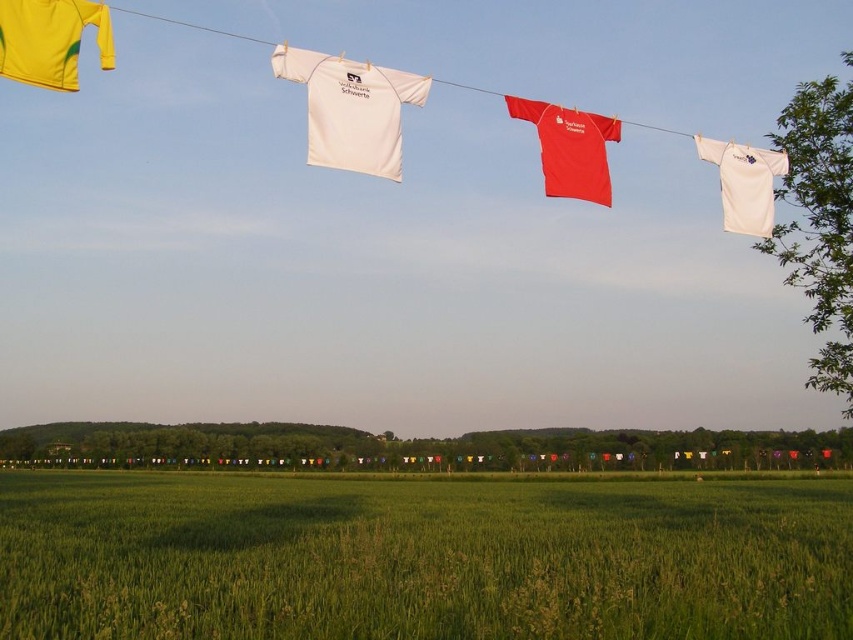
Question: Which of the following is the farthest from the observer?

Choices:
 (A) (816, 387)
 (B) (79, 492)
 (C) (323, 72)
 (D) (759, 182)

Answer: (B)

Question: Which object is positioned farthest from the matte red t-shirt at center?

Choices:
 (A) white matte t-shirt at upper center
 (B) white fabric shirt at center
 (C) green leafy tree at upper right
 (D) green grass at lower center

Answer: (C)

Question: Considering the real-world distances, which object is farthest from the green leafy tree at center?

Choices:
 (A) matte red t-shirt at center
 (B) green leafy tree at upper right
 (C) white fabric shirt at center
 (D) white matte t-shirt at upper center

Answer: (A)

Question: From the image, what is the correct spatial relationship of green leafy tree at center in relation to white matte t-shirt at upper center?

Choices:
 (A) right
 (B) left

Answer: (B)

Question: Can you confirm if green grass at lower center is positioned to the right of white matte t-shirt at upper center?

Choices:
 (A) no
 (B) yes

Answer: (A)

Question: Does matte red t-shirt at center appear on the left side of white matte t-shirt at upper center?

Choices:
 (A) yes
 (B) no

Answer: (A)